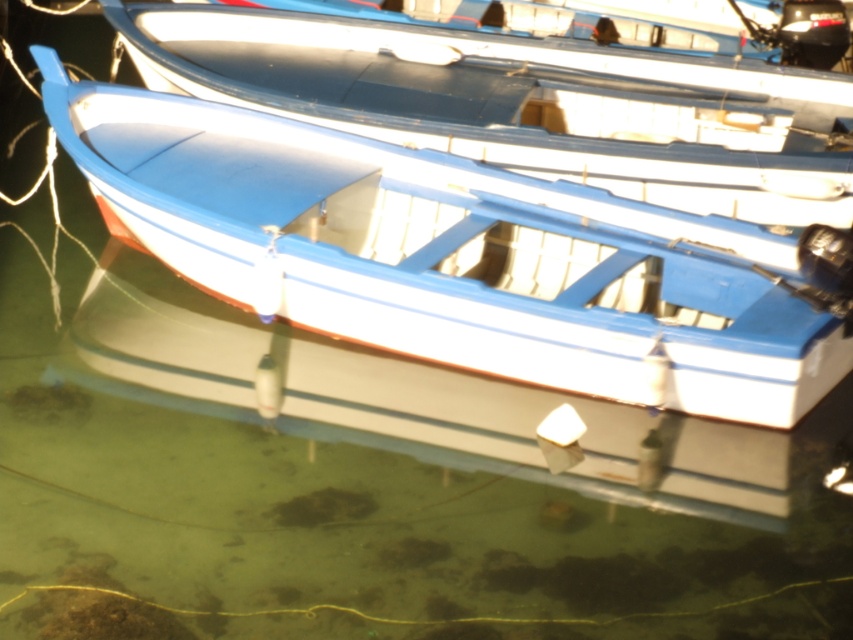
Is matte blue canoe at center below blue matte boat at center?

Correct, matte blue canoe at center is located below blue matte boat at center.

Does point (450, 188) come farther from viewer compared to point (820, 125)?

No, it is not.

Where is `matte blue canoe at center`? matte blue canoe at center is located at coordinates (456, 257).